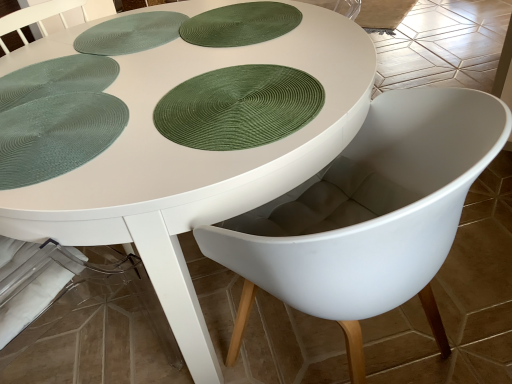
At what (x,y) coordinates should I click in order to perform the action: click on vacant space situated on the left part of green woven placemat at center, which is counted as the second paper plate, starting from the bottom. Please return your answer as a coordinate pair (x, y). This screenshot has width=512, height=384. Looking at the image, I should click on pyautogui.click(x=89, y=129).